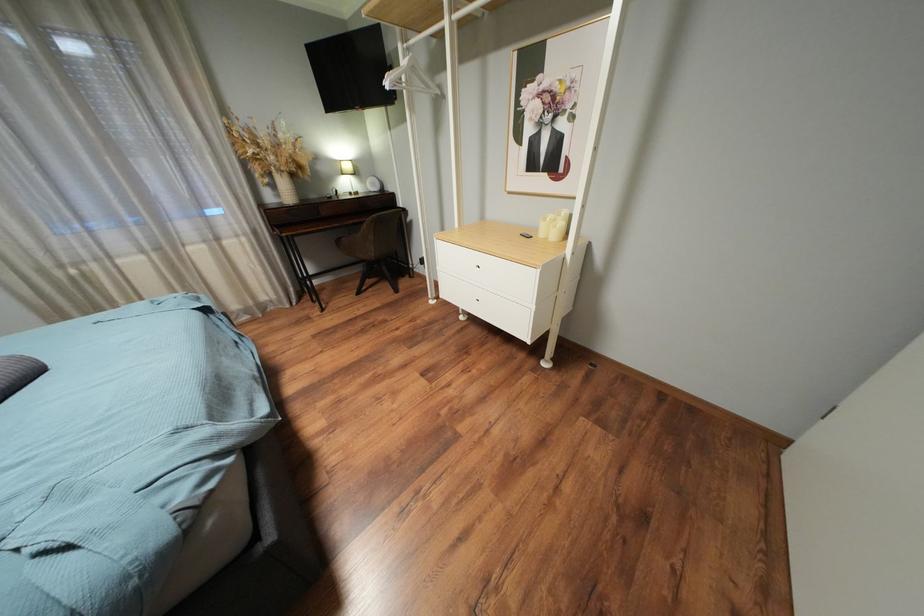
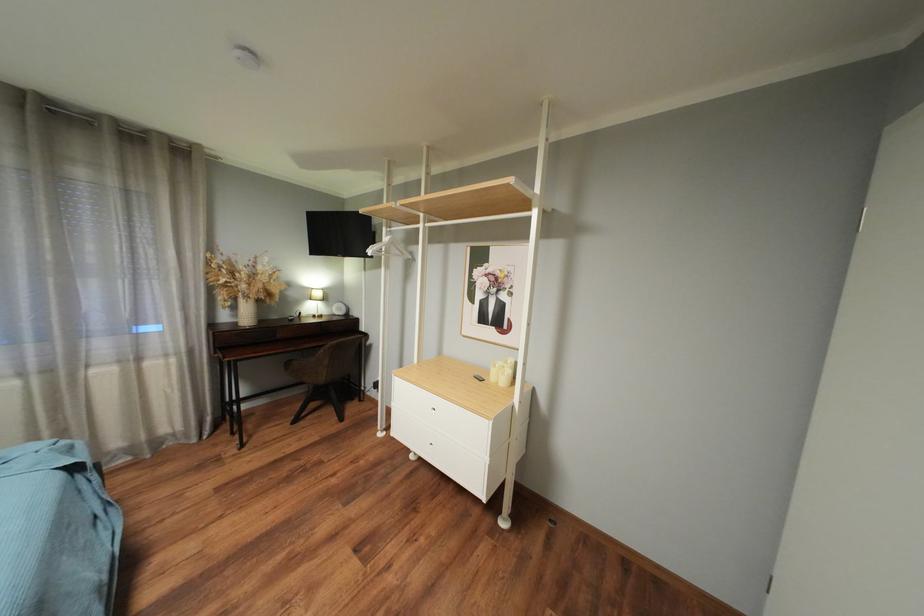
Question: Which direction would the cameraman need to move to produce the second image? Reply with the corresponding letter.

Choices:
 (A) Left
 (B) Right
 (C) Forward
 (D) Backward

Answer: (D)